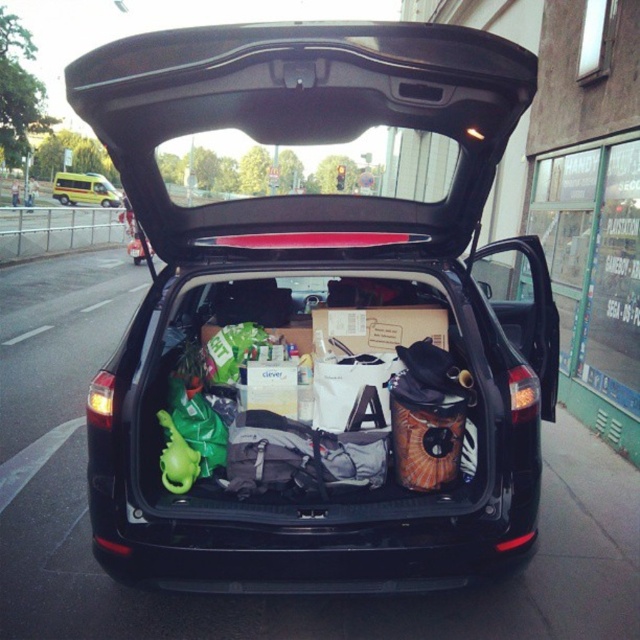
Is point (246, 58) positioned before point (81, 192)?

Yes, point (246, 58) is closer to viewer.

Who is more distant from viewer, (419, 392) or (90, 189)?

The point (90, 189) is behind.

Which is behind, point (424, 564) or point (104, 186)?

The point (104, 186) is behind.

Locate an element on the screen. black matte car trunk at center is located at coordinates (314, 314).